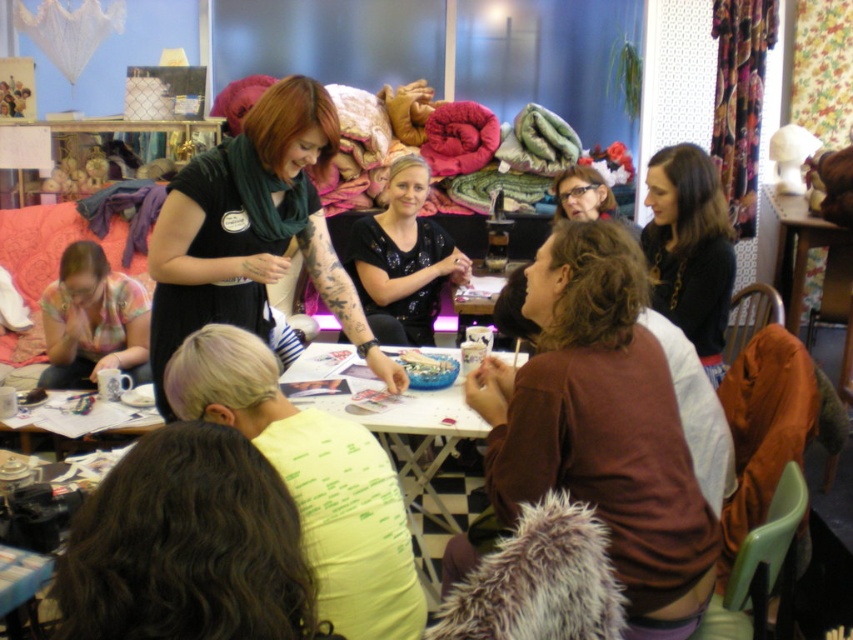
You are a delivery person who needs to place a small package between the black matte shirt at center and the black fabric at upper right. The package is 4 feet long. Will it fit in the space between them?

The distance between the black matte shirt at center and the black fabric at upper right is 3.71 feet. Since the package is 4 feet long, it will not fit in the space between them.

You are organizing a small craft event and need to place a decorative item on the table. The light yellow fabric at center and the black sequined top at center are both on the table. Which object has a larger width to serve as a better base for the decorative item?

The light yellow fabric at center is wider than the black sequined top at center, making it a better choice for a base as it provides more surface area.

You are standing in the workshop and need to find the black matte shirt at center. According to the coordinates provided, where exactly is it positioned?

The black matte shirt at center is located at point [252,230].